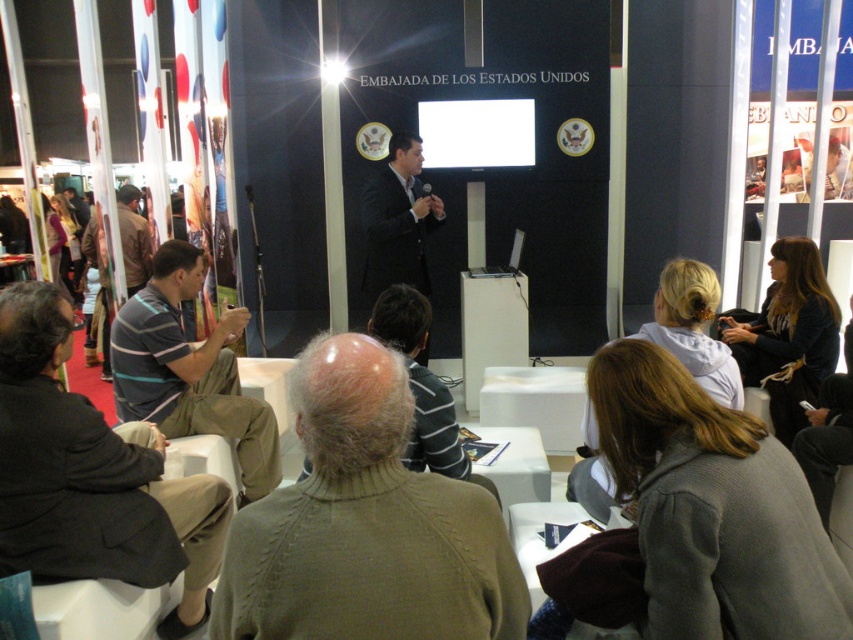
Is light brown hair at center positioned behind dark suit at center?

No, light brown hair at center is closer to the viewer.

Is point (567, 492) behind point (424, 224)?

No, it is not.

Identify the location of light brown hair at center. (693, 328).

Is point (123, 348) in front of point (430, 214)?

Yes, it is in front of point (430, 214).

Does striped cotton shirt at left have a lesser width compared to dark suit at center?

No, striped cotton shirt at left is not thinner than dark suit at center.

Is point (273, 422) farther from camera compared to point (387, 285)?

No, it is not.

Find the location of a particular element. striped cotton shirt at left is located at coordinates (189, 371).

Does knitted green sweater at center appear over dark brown hair at right?

No, knitted green sweater at center is not above dark brown hair at right.

Identify the location of knitted green sweater at center. (366, 524).